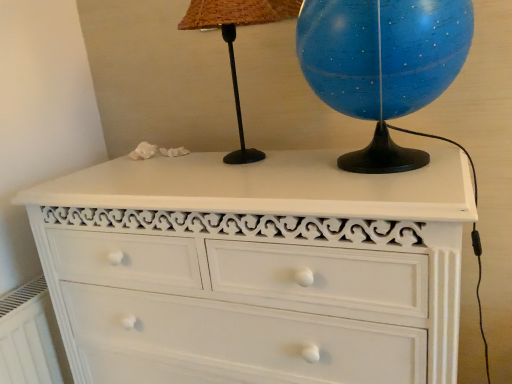
Question: Should I look upward or downward to see white painted wood chest of drawers at center?

Choices:
 (A) up
 (B) down

Answer: (B)

Question: Considering the relative sizes of blue glossy globe at upper right and white painted radiator at lower left in the image provided, is blue glossy globe at upper right bigger than white painted radiator at lower left?

Choices:
 (A) yes
 (B) no

Answer: (A)

Question: Is blue glossy globe at upper right at the left side of white painted radiator at lower left?

Choices:
 (A) no
 (B) yes

Answer: (A)

Question: Is blue glossy globe at upper right to the right of white painted radiator at lower left from the viewer's perspective?

Choices:
 (A) yes
 (B) no

Answer: (A)

Question: Is the surface of blue glossy globe at upper right in direct contact with white painted radiator at lower left?

Choices:
 (A) no
 (B) yes

Answer: (A)

Question: Is blue glossy globe at upper right in front of white painted radiator at lower left?

Choices:
 (A) yes
 (B) no

Answer: (A)

Question: From a real-world perspective, is blue glossy globe at upper right below white painted radiator at lower left?

Choices:
 (A) yes
 (B) no

Answer: (B)

Question: Does white painted wood chest of drawers at center come in front of white painted radiator at lower left?

Choices:
 (A) no
 (B) yes

Answer: (B)

Question: From the image's perspective, is white painted wood chest of drawers at center above white painted radiator at lower left?

Choices:
 (A) yes
 (B) no

Answer: (A)

Question: Is white painted wood chest of drawers at center not within white painted radiator at lower left?

Choices:
 (A) yes
 (B) no

Answer: (A)

Question: From the image's perspective, would you say white painted wood chest of drawers at center is shown under white painted radiator at lower left?

Choices:
 (A) yes
 (B) no

Answer: (B)

Question: Is white painted wood chest of drawers at center at the right side of white painted radiator at lower left?

Choices:
 (A) no
 (B) yes

Answer: (B)

Question: Does white painted wood chest of drawers at center turn towards white painted radiator at lower left?

Choices:
 (A) yes
 (B) no

Answer: (B)

Question: From a real-world perspective, is white painted radiator at lower left over white painted wood chest of drawers at center?

Choices:
 (A) no
 (B) yes

Answer: (A)